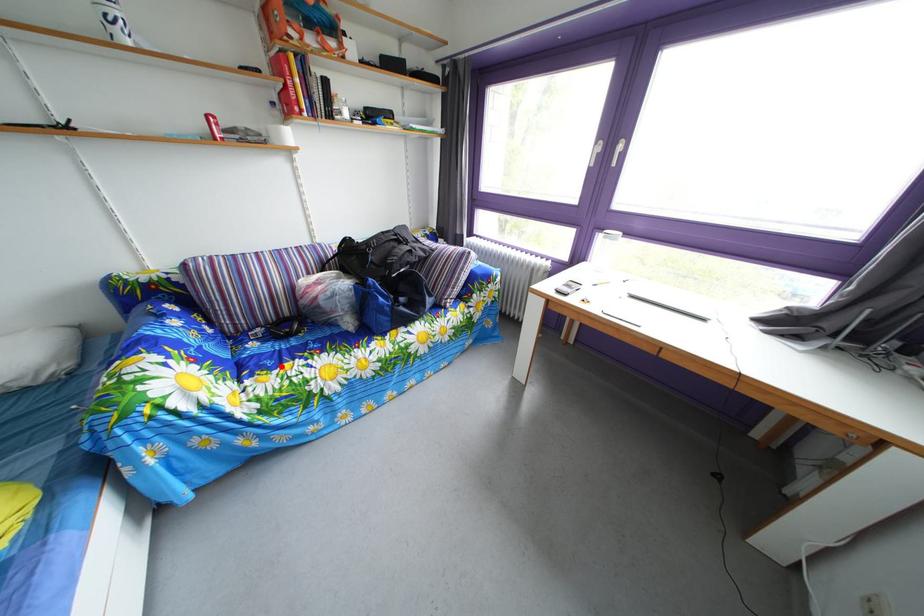
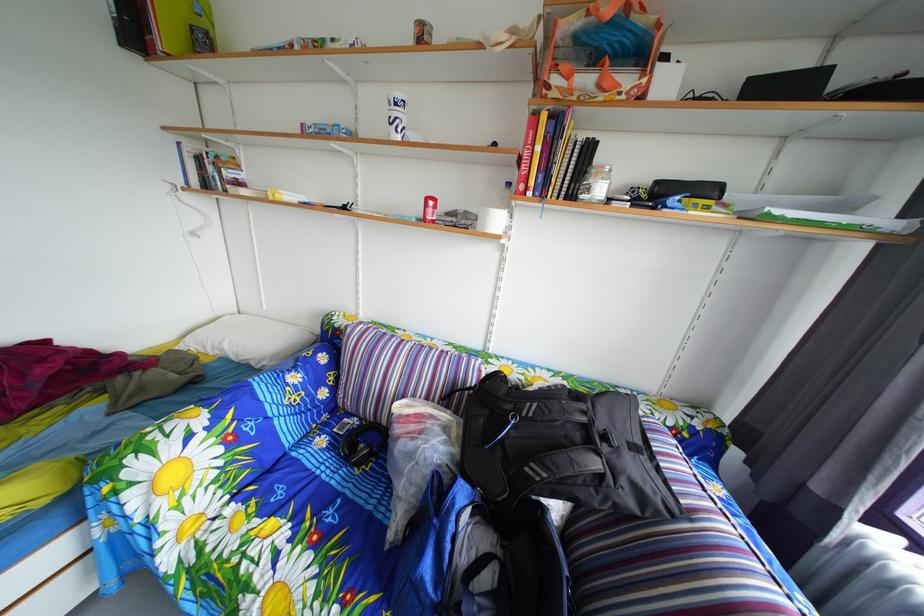
Find the pixel in the second image that matches the highlighted location in the first image.

(301, 493)